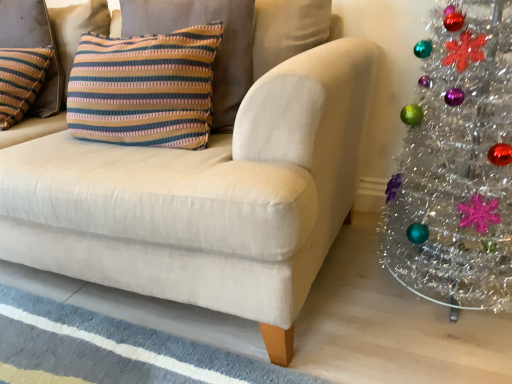
Question: Is matte beige couch at center not within striped fabric pillow at upper left, which is the 2th pillow in left-to-right order?

Choices:
 (A) yes
 (B) no

Answer: (A)

Question: Is matte beige couch at center to the right of striped fabric pillow at upper left, which is the first pillow in right-to-left order, from the viewer's perspective?

Choices:
 (A) yes
 (B) no

Answer: (B)

Question: From a real-world perspective, does matte beige couch at center sit lower than striped fabric pillow at upper left, which is the 2th pillow in left-to-right order?

Choices:
 (A) yes
 (B) no

Answer: (A)

Question: Are matte beige couch at center and striped fabric pillow at upper left, which is the 2th pillow in left-to-right order, far apart?

Choices:
 (A) no
 (B) yes

Answer: (A)

Question: Considering the relative sizes of matte beige couch at center and striped fabric pillow at upper left, which is the first pillow in right-to-left order, in the image provided, is matte beige couch at center smaller than striped fabric pillow at upper left, which is the first pillow in right-to-left order,?

Choices:
 (A) no
 (B) yes

Answer: (A)

Question: From the image's perspective, relative to shiny silver christmas tree at right, is striped fabric pillow at upper left, which is the 2th pillow in left-to-right order, above or below?

Choices:
 (A) below
 (B) above

Answer: (B)

Question: Is striped fabric pillow at upper left, which is the 2th pillow in left-to-right order, wider or thinner than shiny silver christmas tree at right?

Choices:
 (A) thin
 (B) wide

Answer: (A)

Question: Is striped fabric pillow at upper left, which is the first pillow in right-to-left order, bigger or smaller than shiny silver christmas tree at right?

Choices:
 (A) big
 (B) small

Answer: (B)

Question: Does point (155, 125) appear closer or farther from the camera than point (510, 97)?

Choices:
 (A) closer
 (B) farther

Answer: (B)

Question: Considering the positions of point (281, 190) and point (57, 69), is point (281, 190) closer or farther from the camera than point (57, 69)?

Choices:
 (A) closer
 (B) farther

Answer: (A)

Question: Relative to knitted striped pillow at upper left, which ranks as the first pillow in left-to-right order, is matte beige couch at center in front or behind?

Choices:
 (A) front
 (B) behind

Answer: (A)

Question: Do you think matte beige couch at center is within knitted striped pillow at upper left, which ranks as the first pillow in left-to-right order, or outside of it?

Choices:
 (A) inside
 (B) outside

Answer: (B)

Question: Based on their positions, is matte beige couch at center located to the left or right of knitted striped pillow at upper left, positioned as the second pillow in right-to-left order?

Choices:
 (A) right
 (B) left

Answer: (A)

Question: Is matte beige couch at center bigger or smaller than striped fabric pillow at upper left, which is the 2th pillow in left-to-right order?

Choices:
 (A) big
 (B) small

Answer: (A)

Question: From the image's perspective, is matte beige couch at center positioned above or below striped fabric pillow at upper left, which is the first pillow in right-to-left order?

Choices:
 (A) below
 (B) above

Answer: (A)